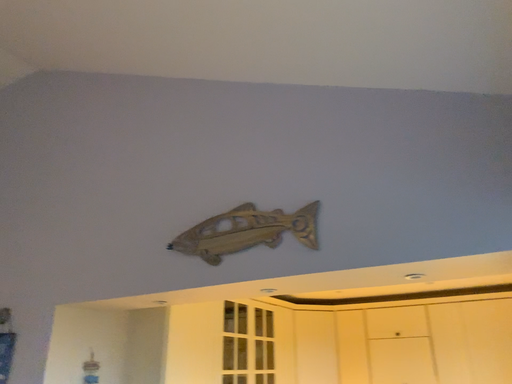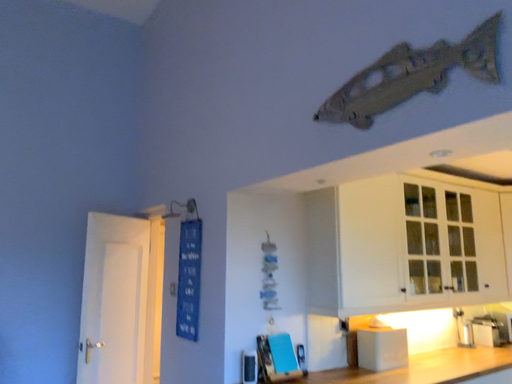
Question: How did the camera likely rotate when shooting the video?

Choices:
 (A) rotated upward
 (B) rotated downward

Answer: (B)